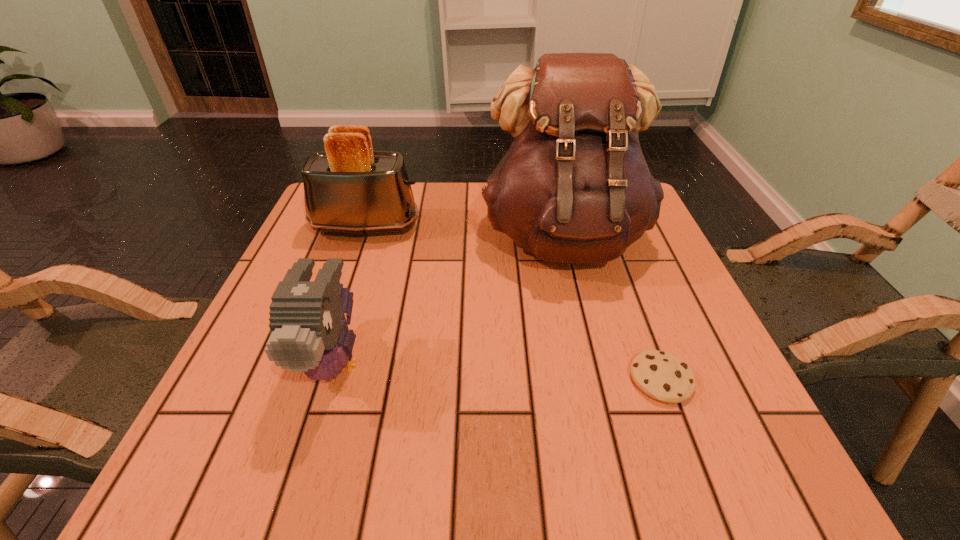
The image size is (960, 540). In order to click on vacant area that satisfies the following two spatial constraints: 1. at the beak of the bird; 2. on the right side of the shortest object in this screenshot , I will do `click(329, 379)`.

You are a GUI agent. You are given a task and a screenshot of the screen. Output one action in this format:
    pyautogui.click(x=<x>, y=<y>)
    Task: Click on the vacant region that satisfies the following two spatial constraints: 1. on the side of the second tallest object with the control lever; 2. on the right side of the cookie
    The width and height of the screenshot is (960, 540).
    Given the screenshot: What is the action you would take?
    pyautogui.click(x=314, y=379)

Locate an element on the screen. Image resolution: width=960 pixels, height=540 pixels. vacant region that satisfies the following two spatial constraints: 1. at the front of the satchel with buckles; 2. on the right side of the shortest object is located at coordinates (599, 379).